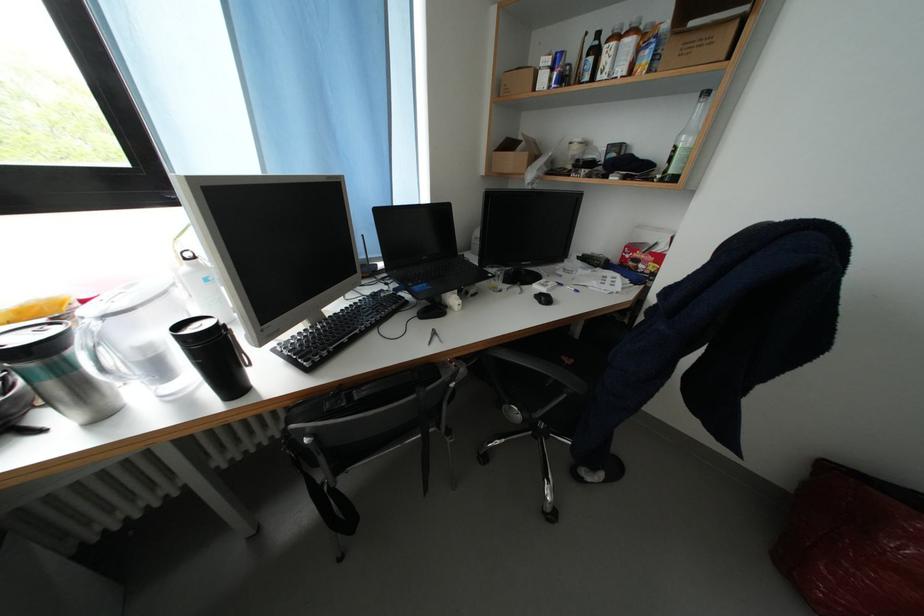
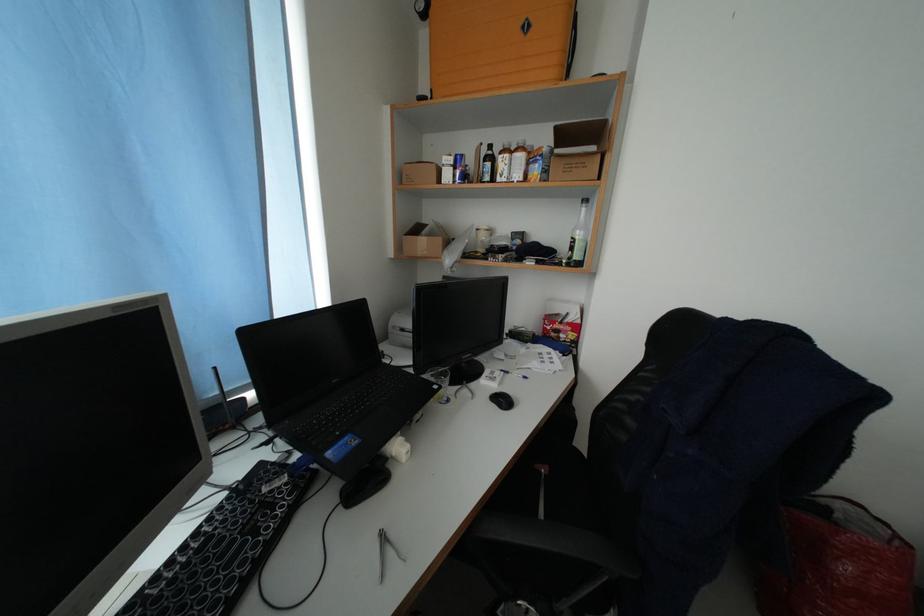
The point at (x=598, y=47) is marked in the first image. Where is the corresponding point in the second image?

(492, 156)